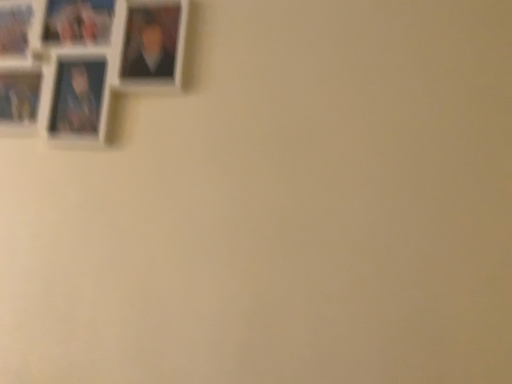
What do you see at coordinates (83, 62) in the screenshot?
I see `white plastic picture frame at upper left` at bounding box center [83, 62].

Measure the distance between white plastic picture frame at upper left and camera.

A distance of 33.29 inches exists between white plastic picture frame at upper left and camera.

Identify the location of white plastic picture frame at upper left. (83, 62).

Locate an element on the screen. white plastic picture frame at upper left is located at coordinates pyautogui.click(x=83, y=62).